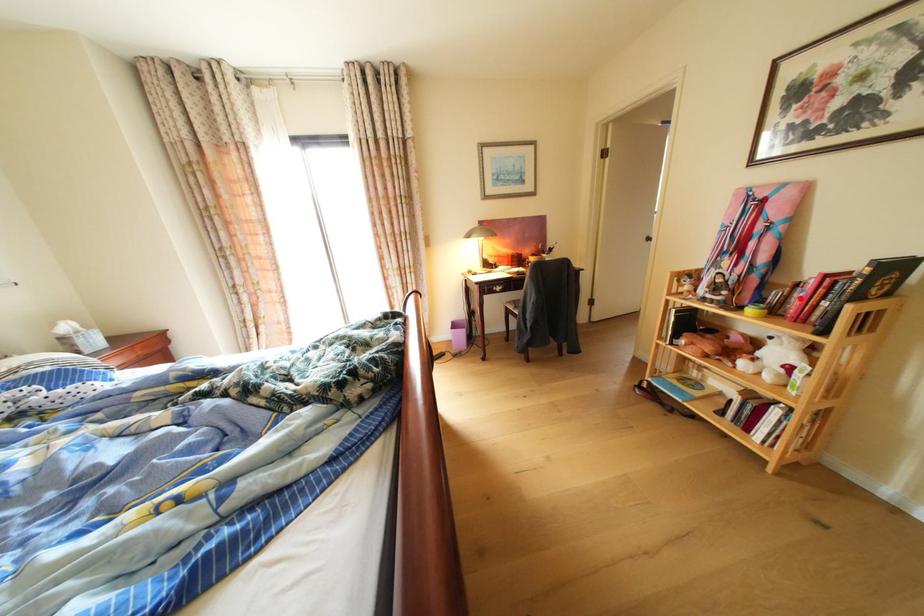
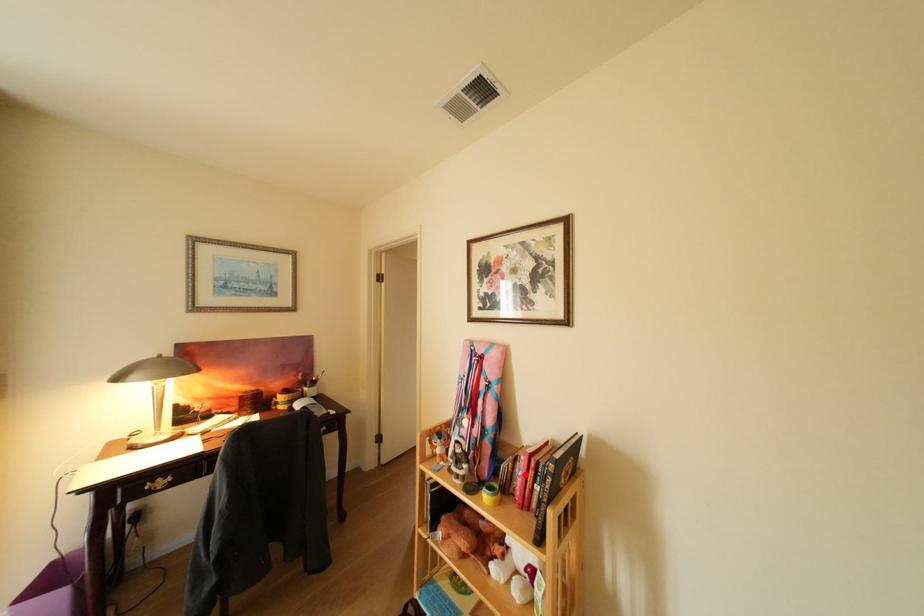
I am providing you with two images of the same scene from different viewpoints. A red point is marked on the first image and another point is marked on the second image. Do the highlighted points in image1 and image2 indicate the same real-world spot?

Yes